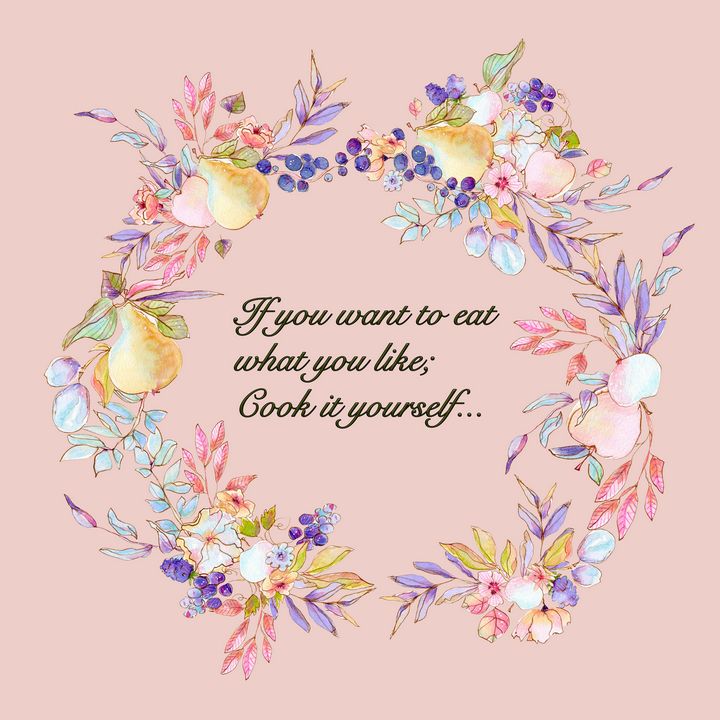
This screenshot has height=720, width=720. In order to click on corners in this screenshot , I will do `click(9, 711)`, `click(11, 6)`, `click(703, 19)`, `click(715, 716)`.